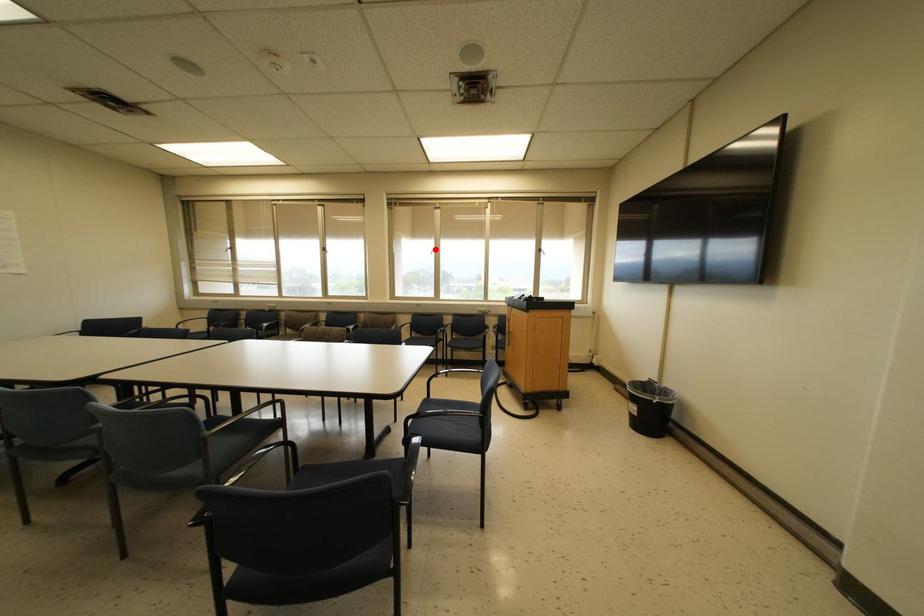
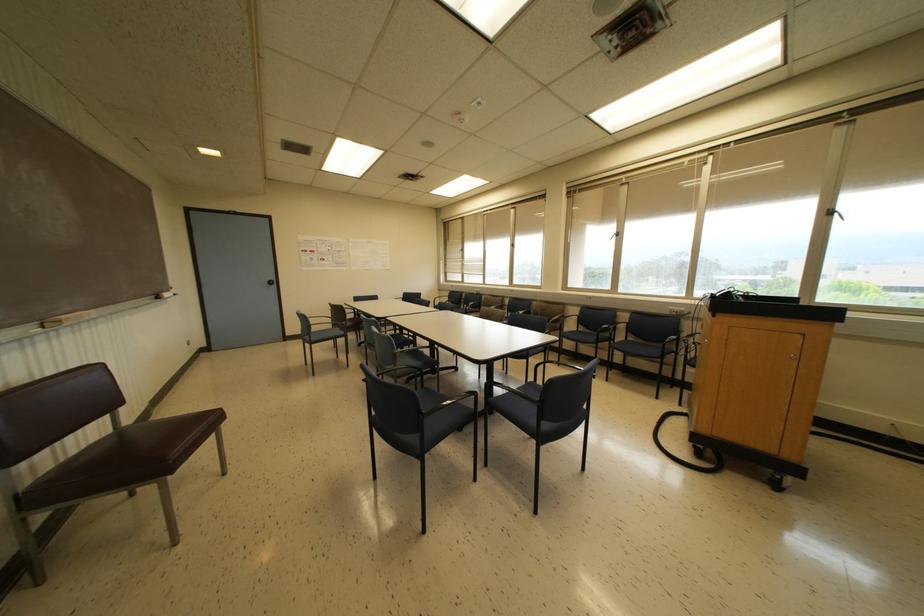
Locate, in the second image, the point that corresponds to the highlighted location in the first image.

(617, 233)